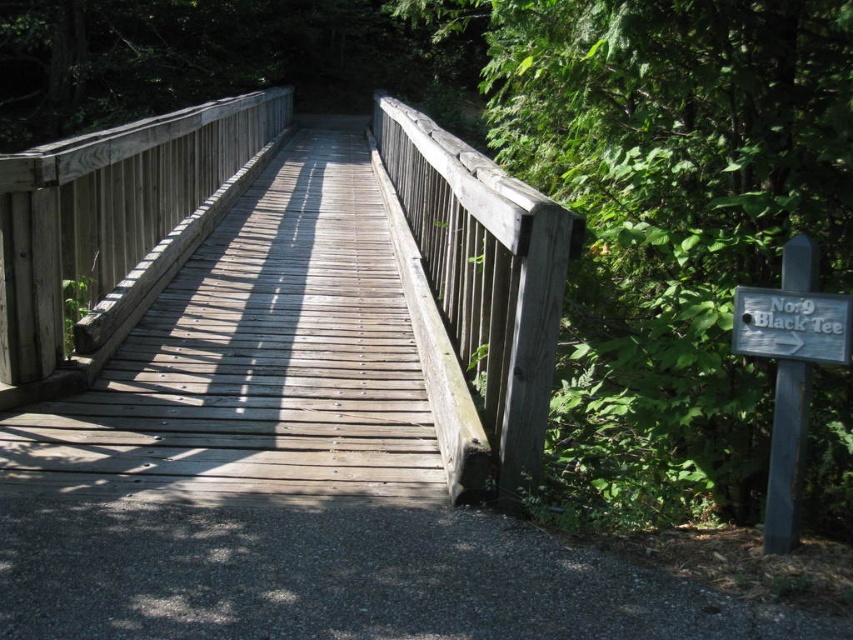
Which is below, wooden bridge at center or white wooden sign at right?

white wooden sign at right is lower down.

Between point (119, 148) and point (834, 356), which one is positioned behind?

Positioned behind is point (119, 148).

What do you see at coordinates (474, 292) in the screenshot?
I see `wooden bridge at center` at bounding box center [474, 292].

This screenshot has width=853, height=640. Find the location of `wooden bridge at center`. wooden bridge at center is located at coordinates pos(474,292).